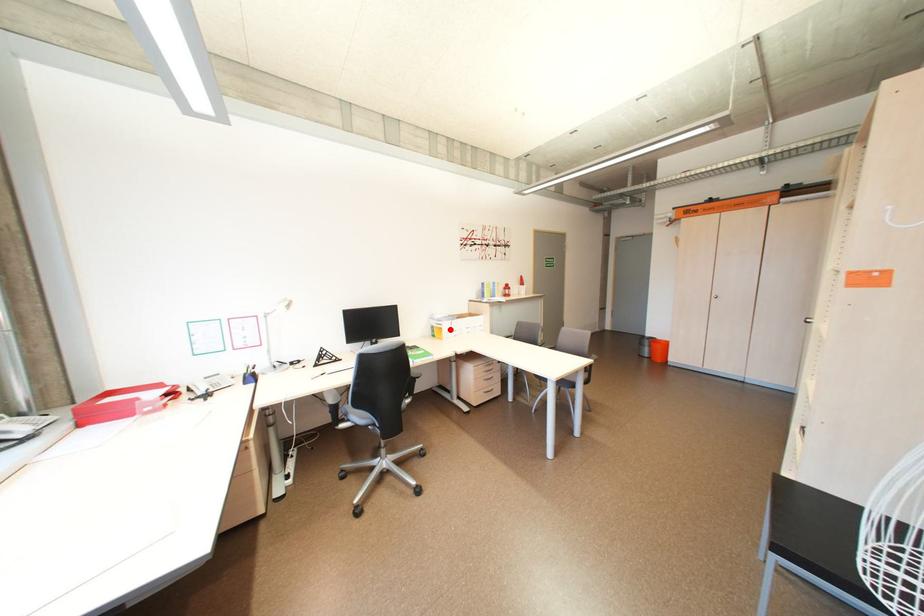
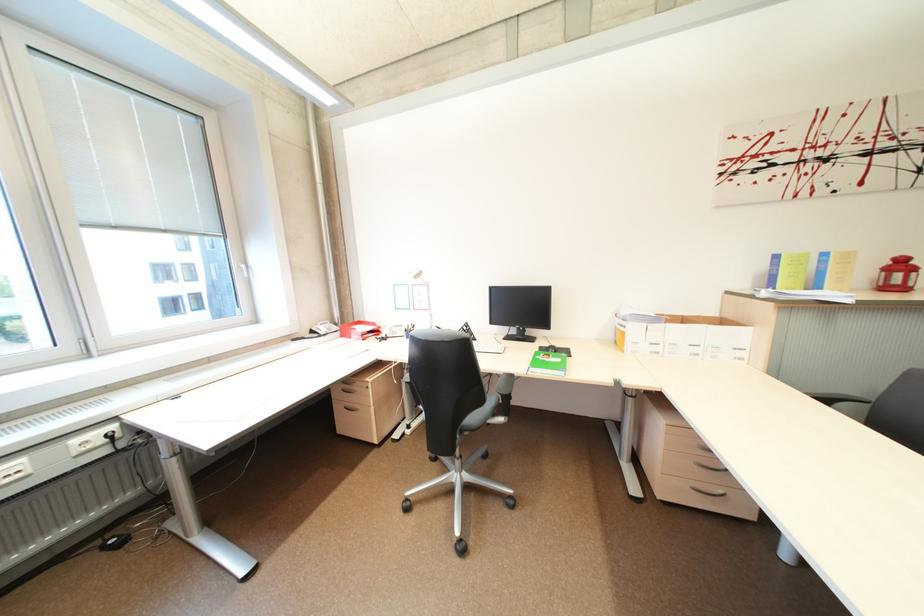
Locate, in the second image, the point that corresponds to the highlighted location in the first image.

(633, 334)